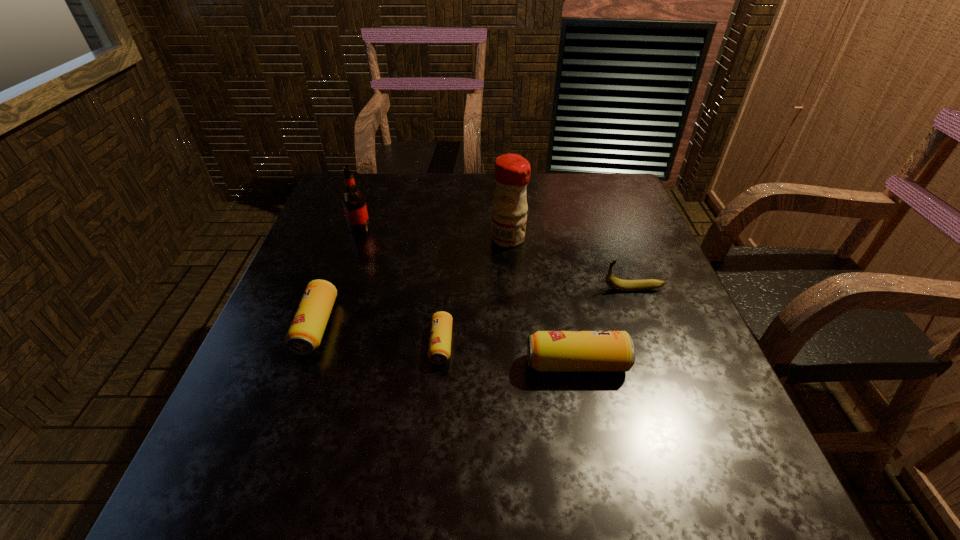
Where is `vacant area between the shortest object and the banana`? vacant area between the shortest object and the banana is located at coordinates (538, 316).

This screenshot has width=960, height=540. In order to click on vacant area that lies between the fourth nearest object and the shortest object in this screenshot , I will do `click(538, 316)`.

Where is `vacant space that's between the tallest object and the root beer`? This screenshot has width=960, height=540. vacant space that's between the tallest object and the root beer is located at coordinates (434, 233).

The width and height of the screenshot is (960, 540). Find the location of `blank region between the fourth nearest object and the second tallest beer can`. blank region between the fourth nearest object and the second tallest beer can is located at coordinates (474, 307).

At what (x,y) coordinates should I click in order to perform the action: click on vacant space that's between the tallest object and the rightmost beer can. Please return your answer as a coordinate pair (x, y). Looking at the image, I should click on (x=542, y=301).

This screenshot has width=960, height=540. Identify the location of object that is the third closest to the fifth shortest object. (439, 350).

Select which object appears as the second closest to the tallest object. Please provide its 2D coordinates. Your answer should be formatted as a tuple, i.e. [(x, y)], where the tuple contains the x and y coordinates of a point satisfying the conditions above.

[(439, 350)]

Identify which beer can is the nearest to the fourth nearest object. Please provide its 2D coordinates. Your answer should be formatted as a tuple, i.e. [(x, y)], where the tuple contains the x and y coordinates of a point satisfying the conditions above.

[(548, 351)]

Identify which beer can is located as the third nearest to the root beer. Please provide its 2D coordinates. Your answer should be formatted as a tuple, i.e. [(x, y)], where the tuple contains the x and y coordinates of a point satisfying the conditions above.

[(548, 351)]

At what (x,y) coordinates should I click in order to perform the action: click on free space that satisfies the following two spatial constraints: 1. at the stem of the third farthest object; 2. on the front side of the rightmost beer can. Please return your answer as a coordinate pair (x, y). The height and width of the screenshot is (540, 960). Looking at the image, I should click on (661, 363).